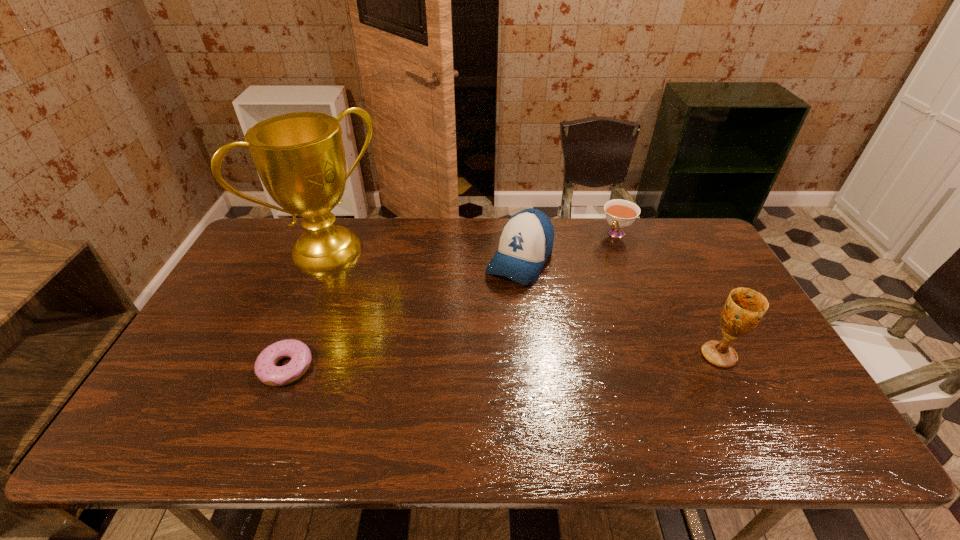
Image resolution: width=960 pixels, height=540 pixels. Identify the location of award present at the far edge. (300, 158).

Where is `teacup located at the far edge`? This screenshot has height=540, width=960. teacup located at the far edge is located at coordinates (620, 214).

The image size is (960, 540). Identify the location of object that is at the near edge. (267, 372).

Locate an element on the screen. This screenshot has height=540, width=960. object at the left edge is located at coordinates (300, 158).

The width and height of the screenshot is (960, 540). Identify the location of object positioned at the right edge. (744, 308).

You are a GUI agent. You are given a task and a screenshot of the screen. Output one action in this format:
    pyautogui.click(x=<x>, y=<y>)
    Task: Click on the object located in the far left corner section of the desktop
    Image resolution: width=960 pixels, height=540 pixels.
    Given the screenshot: What is the action you would take?
    pyautogui.click(x=300, y=158)

At what (x,y) coordinates should I click in order to perform the action: click on vacant space at the far edge of the desktop. Please return your answer as a coordinate pair (x, y). Looking at the image, I should click on (438, 228).

Locate an element on the screen. The height and width of the screenshot is (540, 960). vacant space at the near edge of the desktop is located at coordinates (619, 383).

You are a GUI agent. You are given a task and a screenshot of the screen. Output one action in this format:
    pyautogui.click(x=<x>, y=<y>)
    Task: Click on the free space at the left edge of the desktop
    
    Given the screenshot: What is the action you would take?
    pyautogui.click(x=266, y=265)

You are a GUI agent. You are given a task and a screenshot of the screen. Output one action in this format:
    pyautogui.click(x=<x>, y=<y>)
    Task: Click on the vacant region at the far right corner of the desktop
    
    Given the screenshot: What is the action you would take?
    pyautogui.click(x=689, y=259)